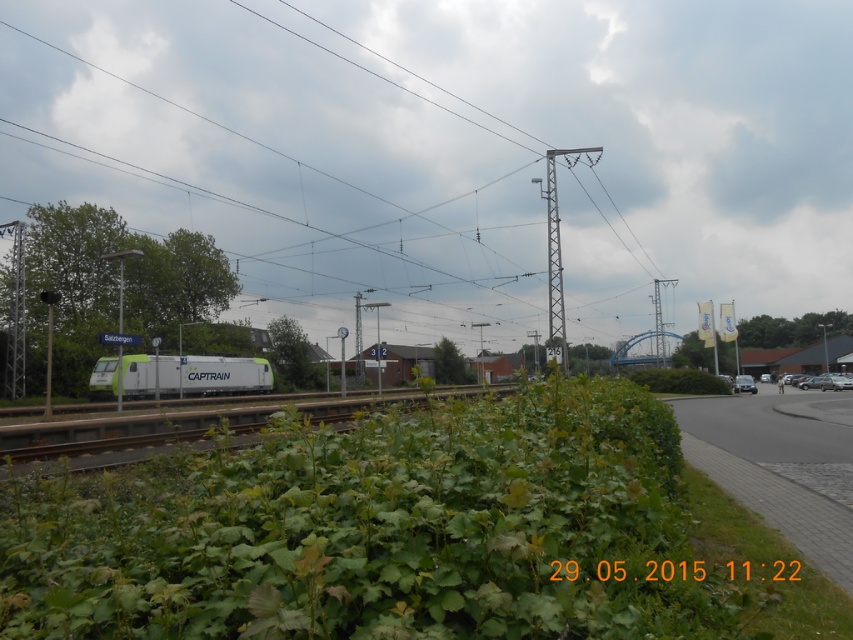
Based on the photo, does green wire at center have a larger size compared to green matte train at center?

Yes.

Is green wire at center wider than green matte train at center?

Yes, green wire at center is wider than green matte train at center.

Describe the element at coordinates (451, 150) in the screenshot. I see `green wire at center` at that location.

Find the location of a particular element. This screenshot has width=853, height=640. green wire at center is located at coordinates (451, 150).